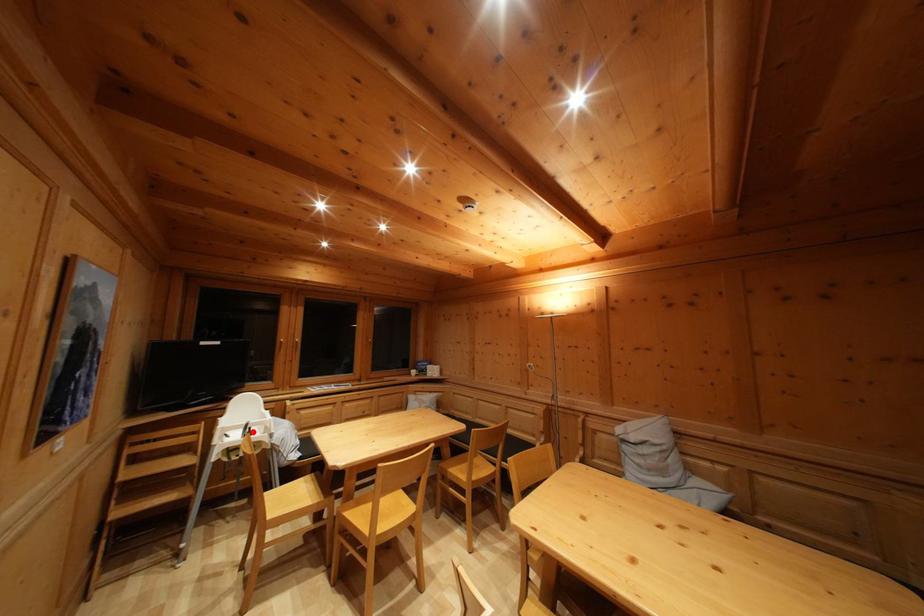
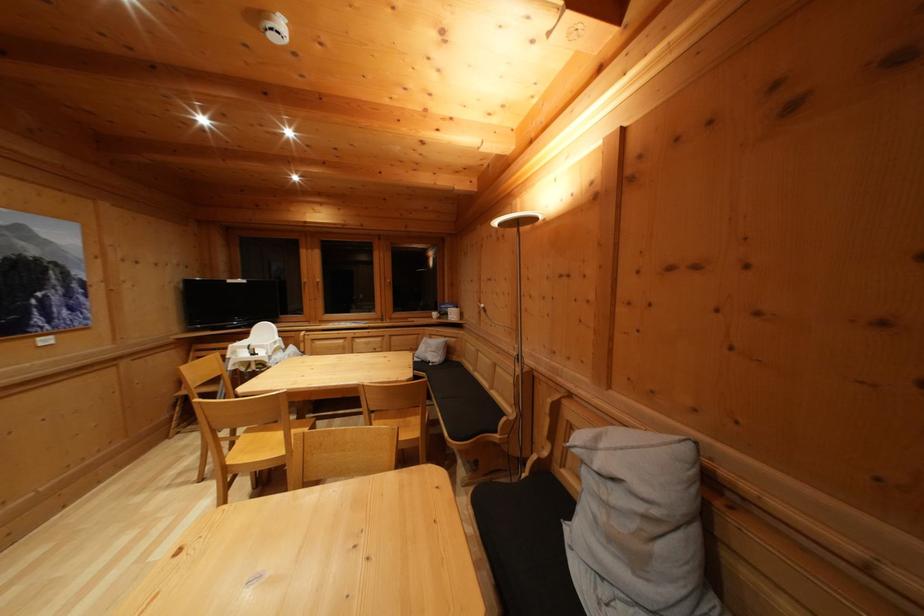
Where in the second image is the point corresponding to the highlighted location from the first image?

(254, 353)